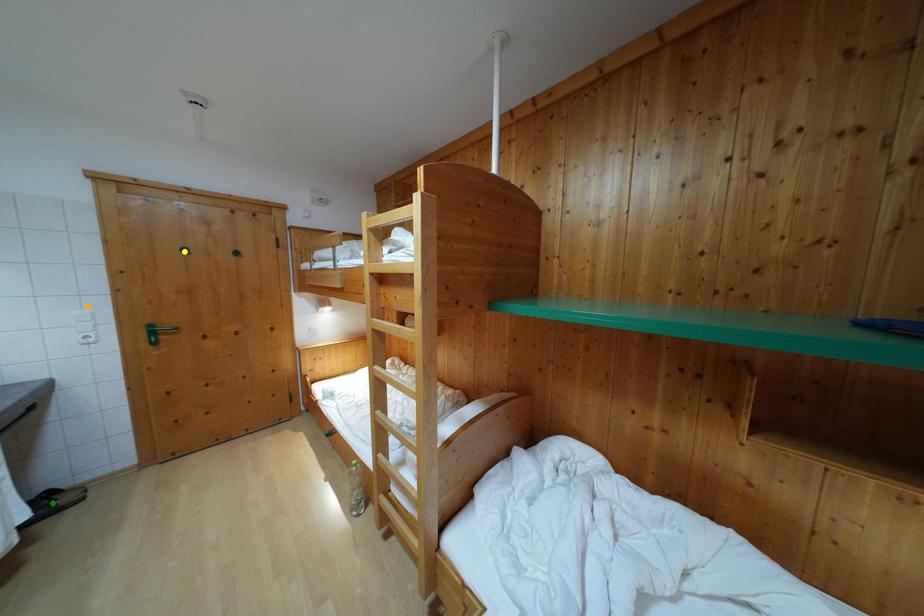
Order these from nearest to farthest:
green point, yellow point, orange point

green point
orange point
yellow point